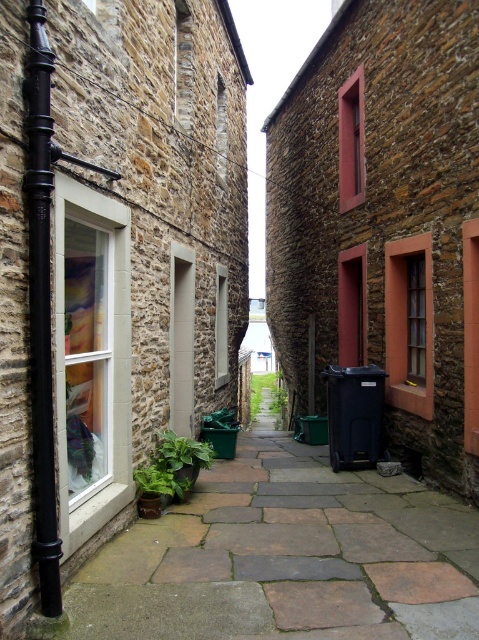
Is green matte plant at lower left bigger than green leafy plant at center?

Incorrect, green matte plant at lower left is not larger than green leafy plant at center.

Can you confirm if green matte plant at lower left is positioned to the left of green leafy plant at center?

Correct, you'll find green matte plant at lower left to the left of green leafy plant at center.

This screenshot has width=479, height=640. I want to click on green matte plant at lower left, so click(x=172, y=465).

What are the coordinates of `green matte plant at lower left` in the screenshot? It's located at (172, 465).